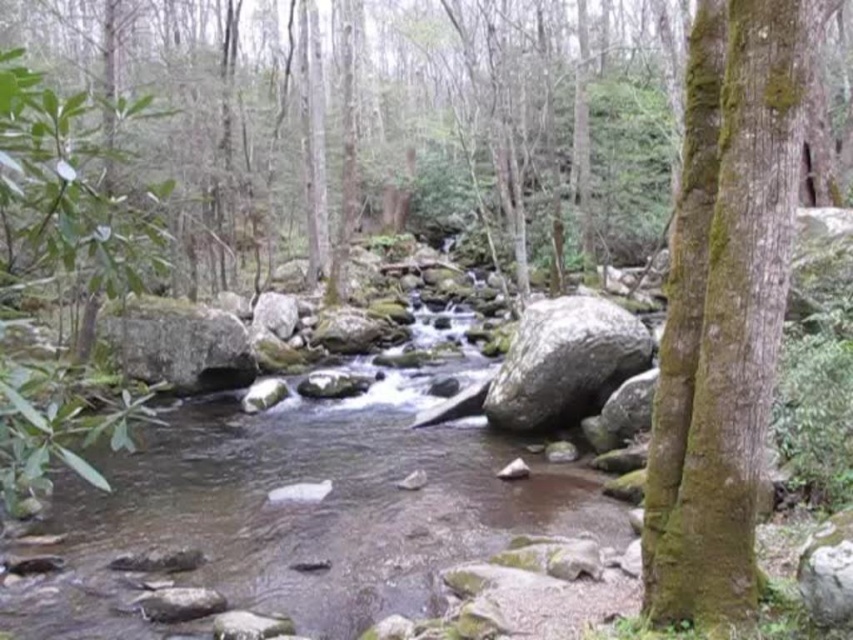
You are standing at the edge of a forest stream and see the clear water at center. You want to place a 15 feet long wooden board across the stream to cross it. Will the board reach from one side to the other?

The distance between you and the clear water at center is 14.97 feet. Since the board is 15 feet long, it should just barely reach across the stream, allowing you to cross safely.

You are a hiker trying to cross the stream in the forest. You see two points marked on the stream bed. The first point is at coordinates point (103,618) and the second is at point (693,140). Which point is closer to you if you are standing on the bank facing the stream?

Point (693,140) is closer to you because it is in front of point (103,618), which is behind it.